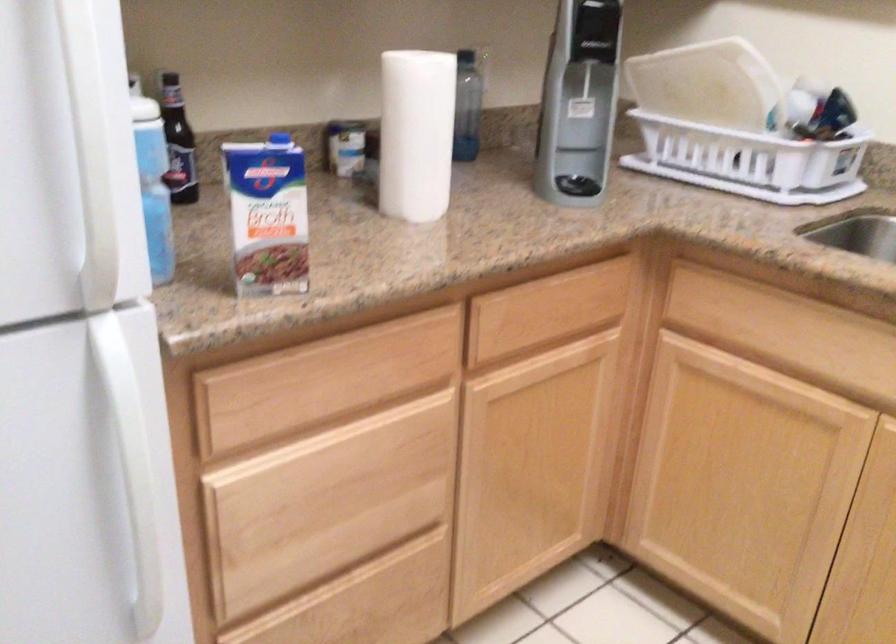
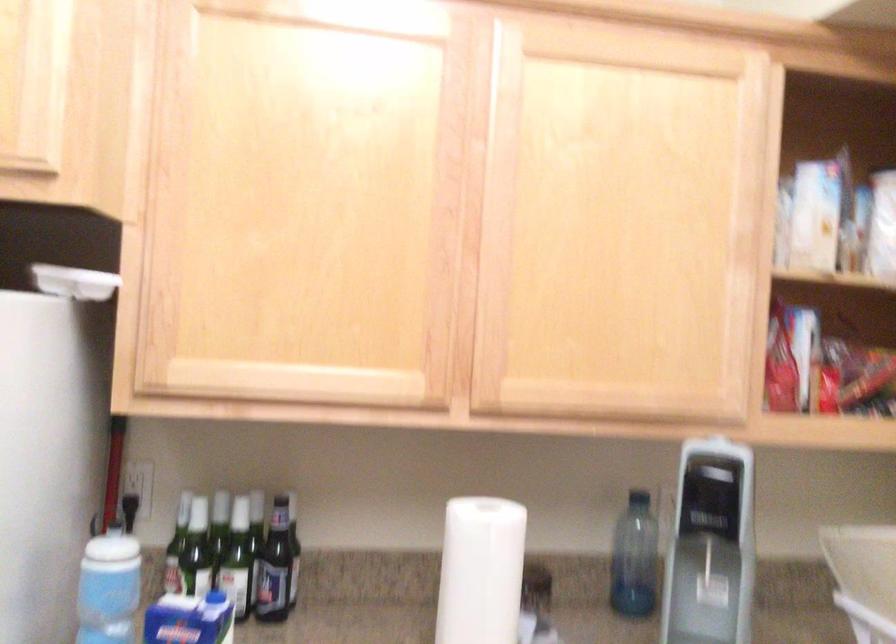
Find the pixel in the second image that matches point (435, 109) in the first image.

(479, 571)